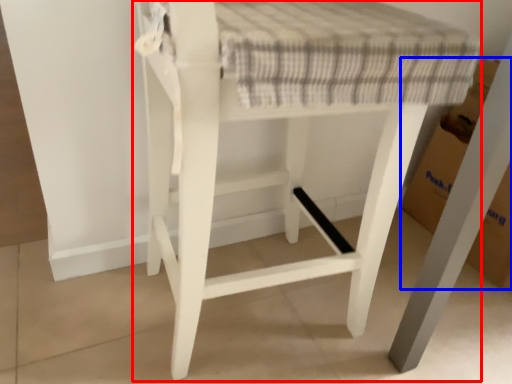
Question: Which of the following is the farthest to the observer, furniture (highlighted by a red box) or cardboard box (highlighted by a blue box)?

Choices:
 (A) furniture
 (B) cardboard box

Answer: (B)